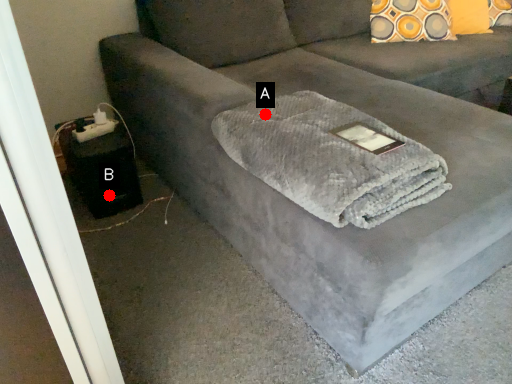
Question: Two points are circled on the image, labeled by A and B beside each circle. Among these points, which one is farthest from the camera?

Choices:
 (A) A is further
 (B) B is further

Answer: (B)